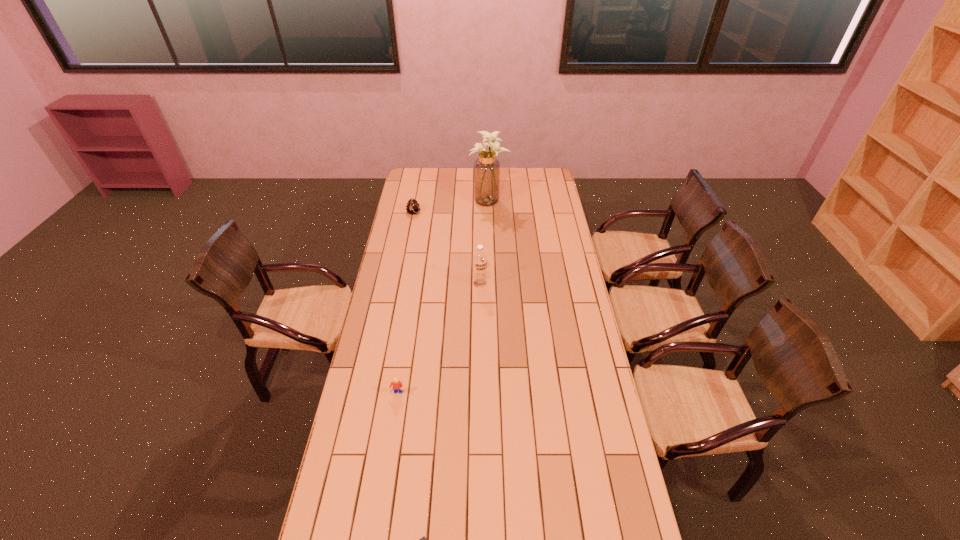
Find the location of a particular element. The width and height of the screenshot is (960, 540). the tallest object is located at coordinates (486, 168).

Where is `the fourth shortest object`? the fourth shortest object is located at coordinates (480, 259).

You are a GUI agent. You are given a task and a screenshot of the screen. Output one action in this format:
    pyautogui.click(x=<x>, y=<y>)
    Task: Click on the vodka
    
    Given the screenshot: What is the action you would take?
    pyautogui.click(x=480, y=259)

Find the location of a particular element. Image resolution: width=960 pixels, height=540 pixels. pinecone is located at coordinates (412, 206).

The image size is (960, 540). What are the coordinates of `the second nearest object` in the screenshot? It's located at (397, 385).

Locate an element on the screen. The height and width of the screenshot is (540, 960). vacant space located 0.260m on the right of the tallest object is located at coordinates (553, 201).

The width and height of the screenshot is (960, 540). What are the coordinates of `vacant space situated 0.330m on the front label of the third nearest object` in the screenshot? It's located at (480, 345).

You are a GUI agent. You are given a task and a screenshot of the screen. Output one action in this format:
    pyautogui.click(x=<x>, y=<y>)
    Task: Click on the free space located with a leaf charm attached to the pinecone
    
    Given the screenshot: What is the action you would take?
    pyautogui.click(x=403, y=263)

Image resolution: width=960 pixels, height=540 pixels. In order to click on free space located 0.290m on the front-facing side of the Lego in this screenshot , I will do `click(384, 476)`.

The height and width of the screenshot is (540, 960). Identify the location of pinecone positioned at the left edge. coord(412,206).